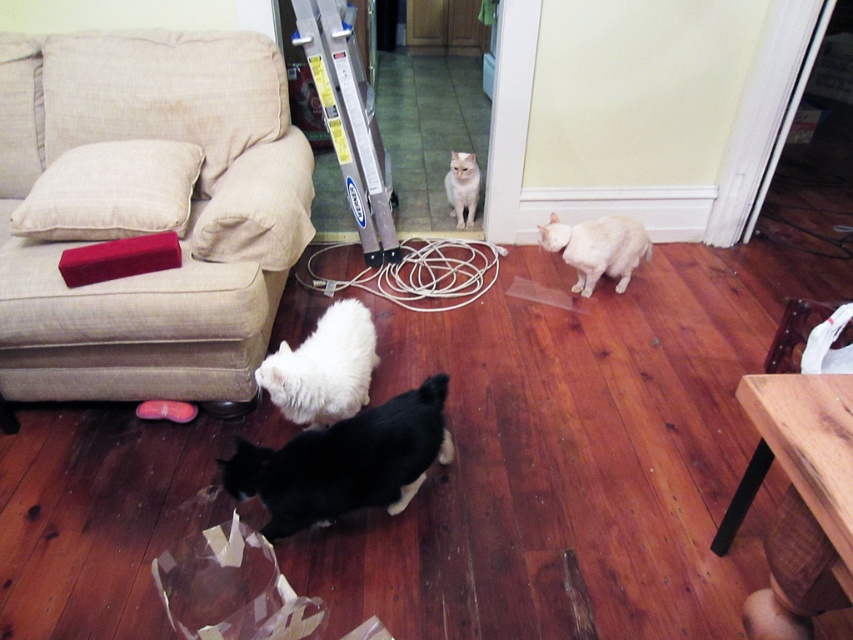
Question: Which is farther from the white fluffy cat at right?

Choices:
 (A) wooden table at lower right
 (B) transparent plastic bag at lower center
 (C) beige fabric couch at lower left

Answer: (B)

Question: Which point is farther to the camera?

Choices:
 (A) (288, 362)
 (B) (850, 301)
 (C) (270, 528)

Answer: (B)

Question: Considering the relative positions of wooden table at lower right and white fluffy cat at center in the image provided, where is wooden table at lower right located with respect to white fluffy cat at center?

Choices:
 (A) right
 (B) left

Answer: (A)

Question: Which point is closer to the camera taking this photo?

Choices:
 (A) (579, 230)
 (B) (305, 499)

Answer: (B)

Question: Is the position of white paper bag at lower right more distant than that of white fluffy cat at center?

Choices:
 (A) yes
 (B) no

Answer: (B)

Question: Is transparent plastic bag at lower center below white paper bag at lower right?

Choices:
 (A) yes
 (B) no

Answer: (A)